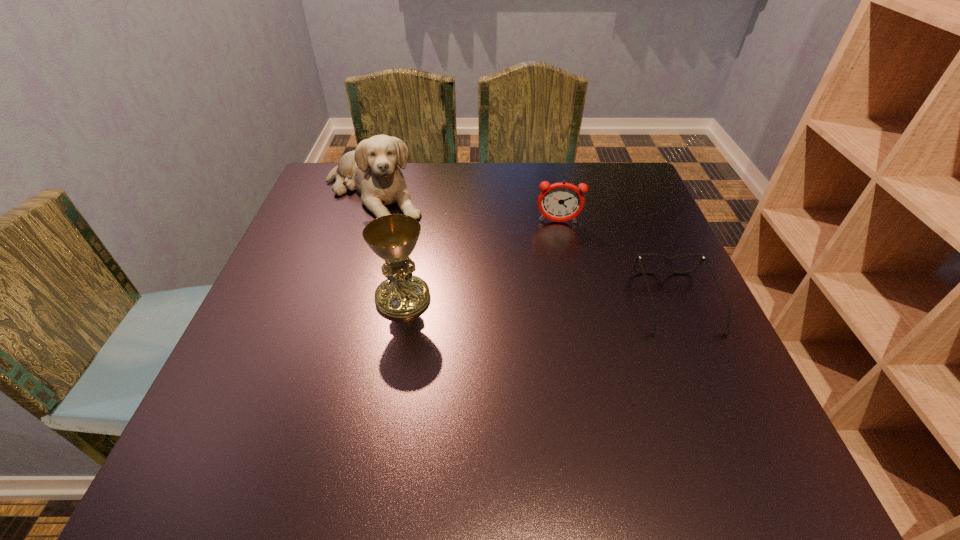
The width and height of the screenshot is (960, 540). In order to click on vacant area at the left edge of the desktop in this screenshot , I will do `click(324, 339)`.

Identify the location of free space at the right edge. This screenshot has width=960, height=540. (649, 263).

In the image, there is a desktop. At what (x,y) coordinates should I click in order to perform the action: click on vacant region at the far right corner. Please return your answer as a coordinate pair (x, y). This screenshot has height=540, width=960. Looking at the image, I should click on (654, 209).

You are a GUI agent. You are given a task and a screenshot of the screen. Output one action in this format:
    pyautogui.click(x=<x>, y=<y>)
    Task: Click on the free space between the spectacles and the chalice
    Image resolution: width=960 pixels, height=540 pixels.
    Given the screenshot: What is the action you would take?
    pyautogui.click(x=540, y=300)

Where is `free space between the third tallest object and the puppy`? The width and height of the screenshot is (960, 540). free space between the third tallest object and the puppy is located at coordinates [466, 208].

Locate an element on the screen. empty space between the puppy and the shortest object is located at coordinates (524, 248).

The height and width of the screenshot is (540, 960). What are the coordinates of `free point between the chalice and the rightmost object` in the screenshot? It's located at (540, 300).

The height and width of the screenshot is (540, 960). I want to click on vacant space that's between the alarm clock and the rightmost object, so click(617, 262).

You are a GUI agent. You are given a task and a screenshot of the screen. Output one action in this format:
    pyautogui.click(x=<x>, y=<y>)
    Task: Click on the free spot between the rightmost object and the puppy
    This screenshot has height=540, width=960.
    Given the screenshot: What is the action you would take?
    pyautogui.click(x=524, y=248)

Locate an element on the screen. unoccupied area between the third object from left to right and the puppy is located at coordinates (466, 208).